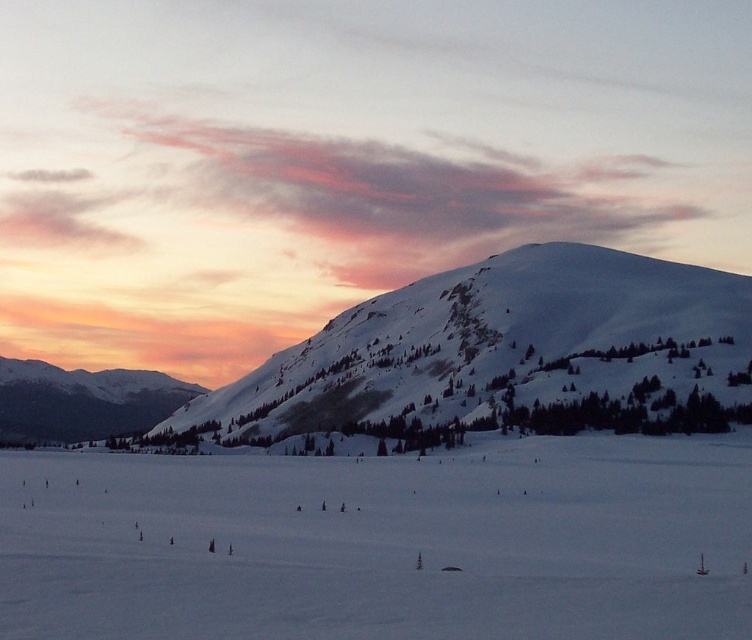
Question: Does white smooth snow at center have a smaller size compared to snowy mountain at left?

Choices:
 (A) no
 (B) yes

Answer: (B)

Question: Among these objects, which one is nearest to the camera?

Choices:
 (A) white snow-covered mountain at center
 (B) snowy mountain at left
 (C) white smooth snow at center

Answer: (C)

Question: Is white smooth snow at center above snowy mountain at left?

Choices:
 (A) no
 (B) yes

Answer: (B)

Question: Which of the following is the farthest from the observer?

Choices:
 (A) (544, 298)
 (B) (138, 385)

Answer: (B)

Question: Which of the following is the farthest from the observer?

Choices:
 (A) (575, 561)
 (B) (79, 387)

Answer: (B)

Question: In this image, where is white snow-covered mountain at center located relative to snowy mountain at left?

Choices:
 (A) right
 (B) left

Answer: (A)